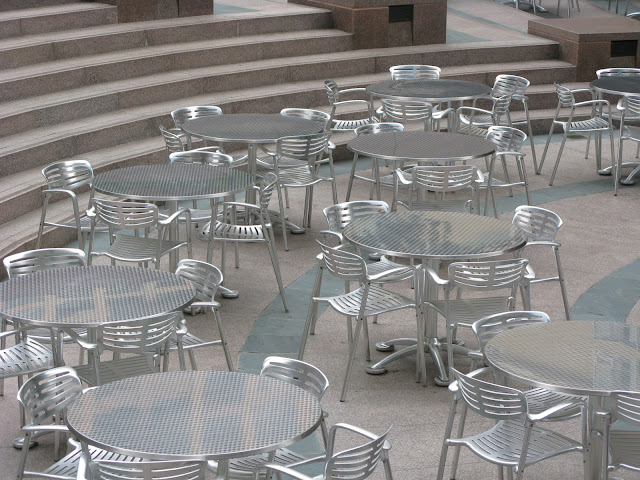
The image size is (640, 480). What are the coordinates of `tables` in the screenshot? It's located at (169, 412), (90, 304), (164, 176), (244, 128), (447, 86), (616, 85), (422, 143), (425, 224), (552, 345).